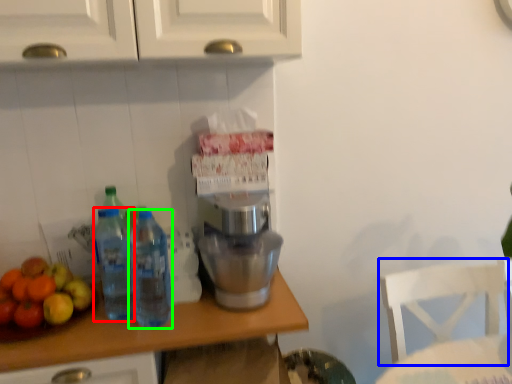
Question: Which object is the farthest from bottle (highlighted by a red box)? Choose among these: chair (highlighted by a blue box) or bottle (highlighted by a green box).

Choices:
 (A) chair
 (B) bottle

Answer: (A)